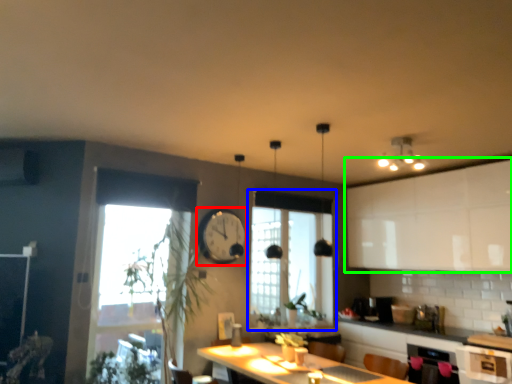
Question: Which object is the closest to the clock (highlighted by a red box)? Choose among these: window (highlighted by a blue box) or cabinetry (highlighted by a green box).

Choices:
 (A) window
 (B) cabinetry

Answer: (A)